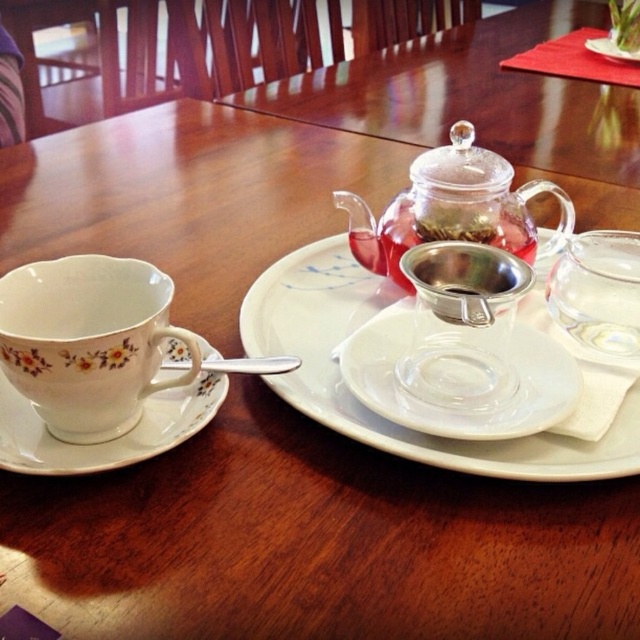
You are a tea lover who wants to pour tea from the teapot into the porcelain floral teacup at left and the white ceramic plate at center. Which object requires you to pour the tea more carefully to avoid spilling?

The porcelain floral teacup at left requires pouring tea more carefully because it has a lesser height compared to the white ceramic plate at center, making it easier to overflow if filled too much.

You are preparing to pour tea from the transparent glass teapot at center into the clear glass teacup at right. Based on their sizes, which one has a greater capacity for holding liquid?

The transparent glass teapot at center has a greater capacity for holding liquid because it is much taller than the clear glass teacup at right.

You are a tea enthusiast who wants to place a decorative item on the table. You have a small figurine that is 3 inches tall. If you want to place it on either the white ceramic saucer at left or the satin silver tea strainer at center, which surface will allow the figurine to be seen clearly without being hidden?

The white ceramic saucer at left is taller than the satin silver tea strainer at center, so placing the figurine on the saucer will provide a higher platform, ensuring it remains visible and not hidden by the strainer.